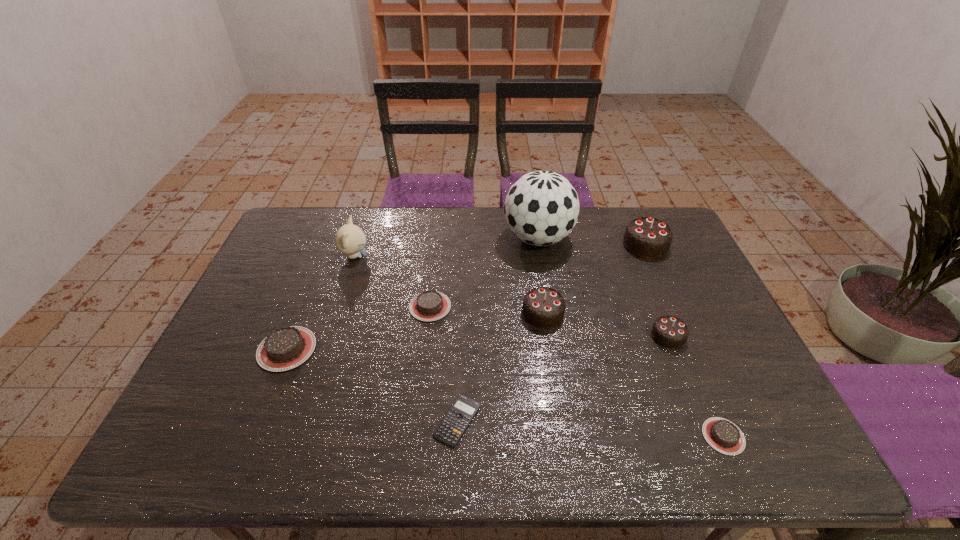
Locate an element on the screen. The width and height of the screenshot is (960, 540). object positioned at the left edge is located at coordinates (285, 348).

The height and width of the screenshot is (540, 960). What are the coordinates of `object present at the far right corner` in the screenshot? It's located at (647, 237).

Where is `object that is at the near right corner`? This screenshot has height=540, width=960. object that is at the near right corner is located at coordinates (724, 436).

In the image, there is a desktop. Where is `vacant region at the far edge`? This screenshot has height=540, width=960. vacant region at the far edge is located at coordinates (469, 213).

In the image, there is a desktop. Identify the location of free space at the near edge. This screenshot has width=960, height=540. (640, 438).

In the image, there is a desktop. Identify the location of vacant space at the left edge. The image size is (960, 540). (308, 266).

Where is `free space at the right edge of the desktop`? The width and height of the screenshot is (960, 540). free space at the right edge of the desktop is located at coordinates (662, 275).

Image resolution: width=960 pixels, height=540 pixels. I want to click on free point between the tallest chocolate cake and the fourth tallest chocolate cake, so click(x=467, y=297).

At what (x,y) coordinates should I click in order to perform the action: click on empty space between the fifth shortest chocolate cake and the fifth shortest object. Please return your answer as a coordinate pair (x, y). This screenshot has width=960, height=540. Looking at the image, I should click on (606, 325).

I want to click on free space between the soccer ball and the second biggest chocolate chocolate cake, so click(540, 276).